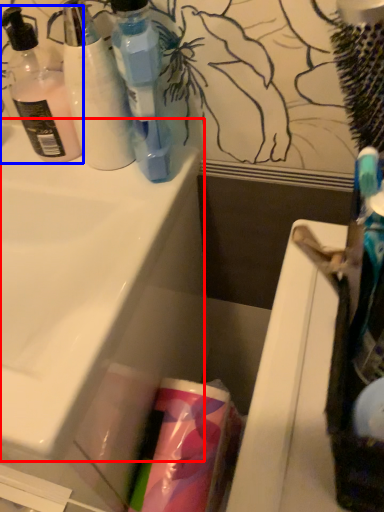
Question: Which object is closer to the camera taking this photo, sink (highlighted by a red box) or bottle (highlighted by a blue box)?

Choices:
 (A) sink
 (B) bottle

Answer: (A)